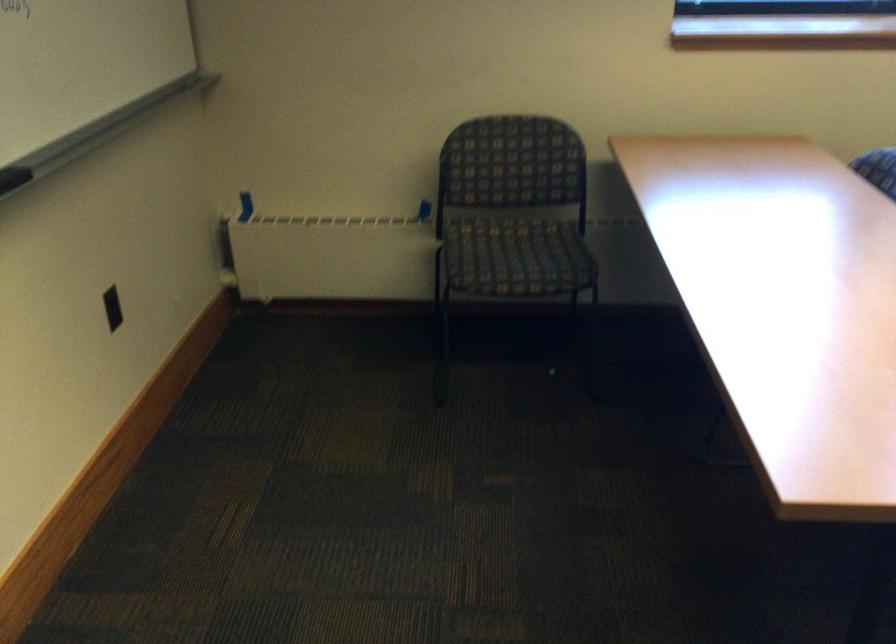
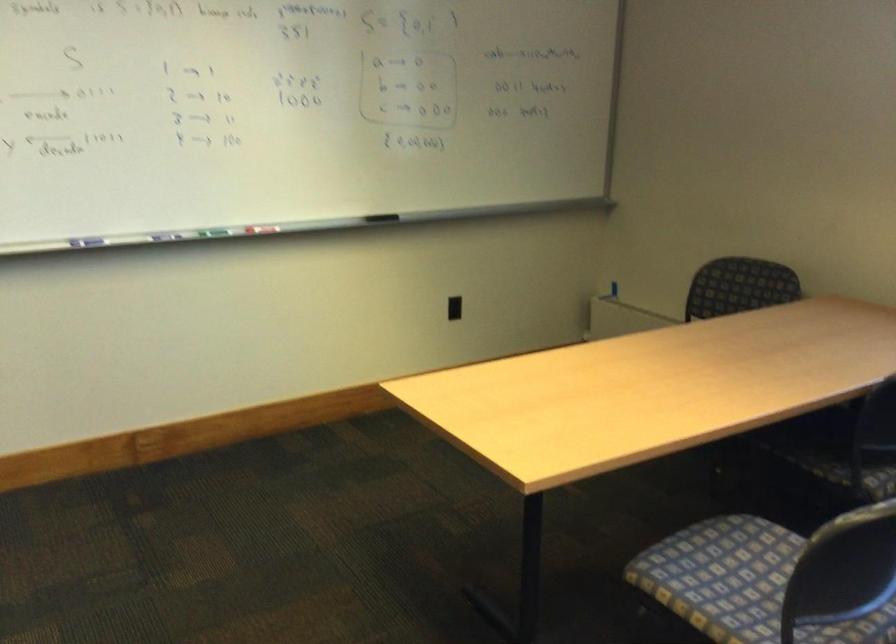
Question: I am providing you with two images of the same scene from different viewpoints. Which of the following objects are not visible in image2?

Choices:
 (A) black power outlet
 (B) cans bin slot
 (C) chair sitting surface
 (D) black whiteboard eraser

Answer: (C)